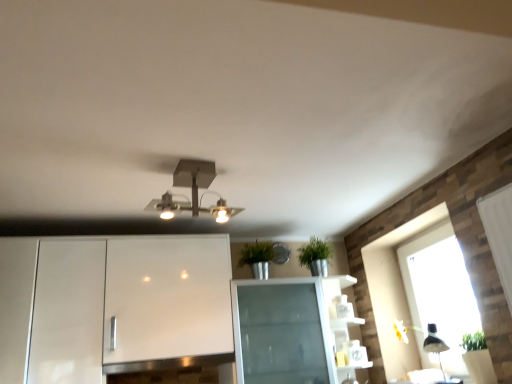
Question: Does metallic square light fixture at center have a lesser width compared to transparent glass window at right?

Choices:
 (A) yes
 (B) no

Answer: (B)

Question: From the image's perspective, is metallic square light fixture at center under transparent glass window at right?

Choices:
 (A) yes
 (B) no

Answer: (B)

Question: Does metallic square light fixture at center lie in front of transparent glass window at right?

Choices:
 (A) yes
 (B) no

Answer: (A)

Question: From a real-world perspective, is metallic square light fixture at center over transparent glass window at right?

Choices:
 (A) no
 (B) yes

Answer: (B)

Question: Is metallic square light fixture at center far from transparent glass window at right?

Choices:
 (A) yes
 (B) no

Answer: (A)

Question: Based on their positions, is black matte lamp at lower right located to the left or right of transparent glass window at right?

Choices:
 (A) right
 (B) left

Answer: (B)

Question: Considering their positions, is black matte lamp at lower right located in front of or behind transparent glass window at right?

Choices:
 (A) behind
 (B) front

Answer: (B)

Question: From a real-world perspective, is black matte lamp at lower right above or below transparent glass window at right?

Choices:
 (A) above
 (B) below

Answer: (B)

Question: Looking at their shapes, would you say black matte lamp at lower right is wider or thinner than transparent glass window at right?

Choices:
 (A) thin
 (B) wide

Answer: (B)

Question: From the image's perspective, is transparent glass window at right located above or below black matte lamp at lower right?

Choices:
 (A) below
 (B) above

Answer: (B)

Question: Is point (398, 276) positioned closer to the camera than point (436, 336)?

Choices:
 (A) farther
 (B) closer

Answer: (A)

Question: Looking at their shapes, would you say transparent glass window at right is wider or thinner than black matte lamp at lower right?

Choices:
 (A) thin
 (B) wide

Answer: (A)

Question: From their relative heights in the image, would you say transparent glass window at right is taller or shorter than black matte lamp at lower right?

Choices:
 (A) short
 (B) tall

Answer: (B)

Question: In the image, is black matte lamp at lower right on the left side or the right side of metallic square light fixture at center?

Choices:
 (A) left
 (B) right

Answer: (B)

Question: Is black matte lamp at lower right taller or shorter than metallic square light fixture at center?

Choices:
 (A) tall
 (B) short

Answer: (A)